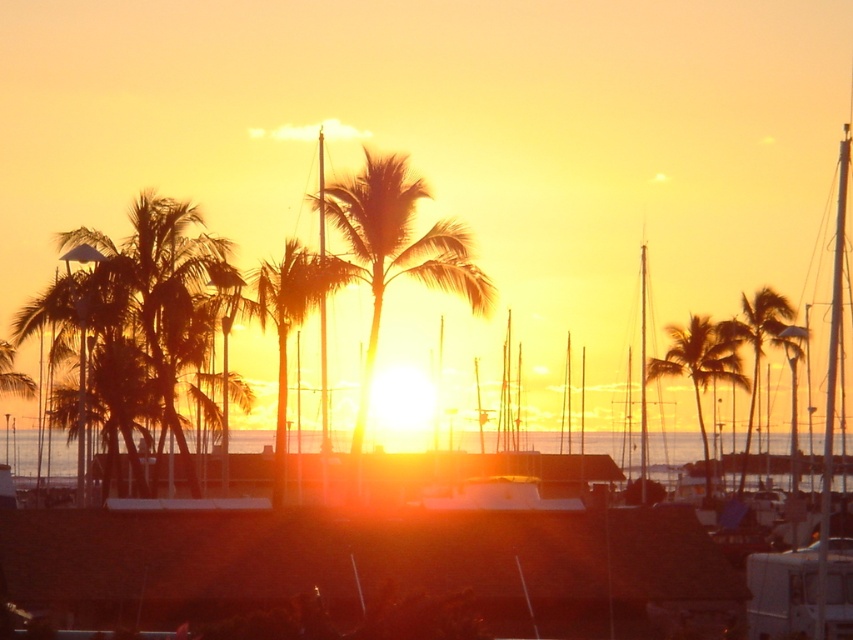
Question: Which point is farther to the camera?

Choices:
 (A) (756, 355)
 (B) (250, 442)
 (C) (706, 452)
 (D) (360, 240)

Answer: (B)

Question: Which point appears farthest from the camera in this image?

Choices:
 (A) (752, 420)
 (B) (672, 460)
 (C) (364, 172)
 (D) (700, 420)

Answer: (B)

Question: Which object is the farthest from the silky gold palm tree at right?

Choices:
 (A) silhouette leafy palm at center
 (B) translucent water at center
 (C) silky brown palm tree at center

Answer: (C)

Question: Is the position of translucent water at center more distant than that of silhouette leafy palm at center?

Choices:
 (A) yes
 (B) no

Answer: (B)

Question: Is silky brown palm tree at center positioned in front of translucent water at center?

Choices:
 (A) no
 (B) yes

Answer: (A)

Question: Can you confirm if silky brown palm tree at center is wider than silky gold palm tree at right?

Choices:
 (A) no
 (B) yes

Answer: (A)